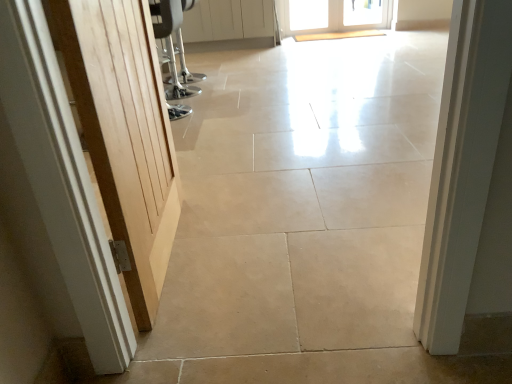
The height and width of the screenshot is (384, 512). What are the coordinates of `white glossy door at upper center, the 2th door from the top` in the screenshot? It's located at (228, 20).

From the image's perspective, is white glossy door at upper center, which is counted as the second door, starting from the back, on light wood door at left, which is the 3th door in back-to-front order?

Indeed, from the image's perspective, white glossy door at upper center, which is counted as the second door, starting from the back, is shown above light wood door at left, which is the 3th door in back-to-front order.

Considering the positions of point (245, 26) and point (124, 142), is point (245, 26) closer or farther from the camera than point (124, 142)?

Clearly, point (245, 26) is more distant from the camera than point (124, 142).

The width and height of the screenshot is (512, 384). In order to click on door below the white glossy door at upper center, the third door in the right-to-left sequence (from the image's perspective) in this screenshot , I will do `click(124, 132)`.

Between point (347, 21) and point (198, 24), which one is positioned behind?

Positioned behind is point (198, 24).

Is there a large distance between white glass door at upper center, which is the 1th door in right-to-left order, and white glossy door at upper center, the 2th door from the top?

They are positioned close to each other.

From the image's perspective, which one is positioned higher, white glass door at upper center, marked as the 1th door in a top-to-bottom arrangement, or white glossy door at upper center, which is the first door in left-to-right order?

white glass door at upper center, marked as the 1th door in a top-to-bottom arrangement, is shown above in the image.

Which is more to the right, white glass door at upper center, which appears as the first door when viewed from the back, or white glossy door at upper center, the 2th door from the top?

white glass door at upper center, which appears as the first door when viewed from the back, is more to the right.

From a real-world perspective, is light wood door at left, arranged as the first door when viewed from the front, located beneath white glass door at upper center, which appears as the first door when viewed from the back?

No, from a real-world perspective, light wood door at left, arranged as the first door when viewed from the front, is not below white glass door at upper center, which appears as the first door when viewed from the back.

Is white glass door at upper center, marked as the 1th door in a top-to-bottom arrangement, a part of light wood door at left, acting as the 2th door starting from the left?

No, white glass door at upper center, marked as the 1th door in a top-to-bottom arrangement, is not inside light wood door at left, acting as the 2th door starting from the left.

Is point (164, 120) closer or farther from the camera than point (341, 0)?

Point (164, 120) appears to be closer to the viewer than point (341, 0).

Does white glass door at upper center, which appears as the first door when viewed from the back, have a smaller size compared to light wood door at left, which is the 3th door in back-to-front order?

Correct, white glass door at upper center, which appears as the first door when viewed from the back, occupies less space than light wood door at left, which is the 3th door in back-to-front order.

From a real-world perspective, is white glass door at upper center, which is the 3th door from left to right, beneath light wood door at left, acting as the 2th door starting from the left?

Yes, from a real-world perspective, white glass door at upper center, which is the 3th door from left to right, is below light wood door at left, acting as the 2th door starting from the left.

Considering the sizes of objects white glass door at upper center, the third door viewed from the front, and light wood door at left, arranged as the first door when viewed from the front, in the image provided, who is thinner, white glass door at upper center, the third door viewed from the front, or light wood door at left, arranged as the first door when viewed from the front,?

Thinner between the two is white glass door at upper center, the third door viewed from the front.

Which is behind, point (169, 137) or point (234, 18)?

Point (234, 18)

Considering the positions of objects light wood door at left, arranged as the first door when viewed from the front, and white glossy door at upper center, placed as the 2th door when sorted from front to back, in the image provided, who is more to the right, light wood door at left, arranged as the first door when viewed from the front, or white glossy door at upper center, placed as the 2th door when sorted from front to back,?

From the viewer's perspective, light wood door at left, arranged as the first door when viewed from the front, appears more on the right side.

In the scene shown: Is there a large distance between light wood door at left, the second door from the right, and white glossy door at upper center, the third door in the right-to-left sequence?

Absolutely, light wood door at left, the second door from the right, is distant from white glossy door at upper center, the third door in the right-to-left sequence.

Could you tell me if light wood door at left, which is the 3th door in back-to-front order, is turned towards white glossy door at upper center, the 2th door from the top?

No, light wood door at left, which is the 3th door in back-to-front order, is not turned towards white glossy door at upper center, the 2th door from the top.

Looking at this image, from a real-world perspective, is white glossy door at upper center, the third door in the right-to-left sequence, physically located above or below white glass door at upper center, marked as the 1th door in a top-to-bottom arrangement?

Clearly, from a real-world perspective, white glossy door at upper center, the third door in the right-to-left sequence, is above white glass door at upper center, marked as the 1th door in a top-to-bottom arrangement.

Does white glossy door at upper center, which is the first door in left-to-right order, lie in front of white glass door at upper center, marked as the 1th door in a top-to-bottom arrangement?

Yes.

From the image's perspective, relative to white glass door at upper center, which is the 3th door from left to right, is white glossy door at upper center, the second door ordered from the bottom, above or below?

Based on their image positions, white glossy door at upper center, the second door ordered from the bottom, is located beneath white glass door at upper center, which is the 3th door from left to right.

Considering the relative sizes of white glossy door at upper center, the third door in the right-to-left sequence, and white glass door at upper center, which is the third door from bottom to top, in the image provided, is white glossy door at upper center, the third door in the right-to-left sequence, thinner than white glass door at upper center, which is the third door from bottom to top,?

In fact, white glossy door at upper center, the third door in the right-to-left sequence, might be wider than white glass door at upper center, which is the third door from bottom to top.

Which door is the 1st one when counting from the back of the light wood door at left, acting as the 2th door starting from the left? Please provide its 2D coordinates.

[(228, 20)]

From a real-world perspective, which door is the 1st one above the white glass door at upper center, which is the 1th door in right-to-left order? Please provide its 2D coordinates.

[(228, 20)]

From the image, which object appears to be farther from light wood door at left, acting as the 2th door starting from the left, white glass door at upper center, the third door viewed from the front, or white glossy door at upper center, placed as the 2th door when sorted from front to back?

white glass door at upper center, the third door viewed from the front.

Based on their spatial positions, is white glass door at upper center, which is the 1th door in right-to-left order, or light wood door at left, the second door from the right, closer to white glossy door at upper center, the third door in the right-to-left sequence?

white glass door at upper center, which is the 1th door in right-to-left order, lies closer to white glossy door at upper center, the third door in the right-to-left sequence, than the other object.

Based on their spatial positions, is white glossy door at upper center, the 2th door from the top, or light wood door at left, the second door from the right, further from white glass door at upper center, which appears as the first door when viewed from the back?

light wood door at left, the second door from the right, lies further to white glass door at upper center, which appears as the first door when viewed from the back, than the other object.

When comparing their distances from white glossy door at upper center, placed as the 2th door when sorted from front to back, does light wood door at left, which is the 3th door in back-to-front order, or white glass door at upper center, the third door viewed from the front, seem closer?

white glass door at upper center, the third door viewed from the front, lies closer to white glossy door at upper center, placed as the 2th door when sorted from front to back, than the other object.

Looking at the image, which one is located closer to white glass door at upper center, which is the 3th door from left to right, light wood door at left, which is the 3th door in back-to-front order, or white glossy door at upper center, placed as the 2th door when sorted from front to back?

white glossy door at upper center, placed as the 2th door when sorted from front to back, is closer to white glass door at upper center, which is the 3th door from left to right.

Which object lies further to the anchor point light wood door at left, arranged as the first door when viewed from the front, white glossy door at upper center, the third door in the right-to-left sequence, or white glass door at upper center, which appears as the first door when viewed from the back?

white glass door at upper center, which appears as the first door when viewed from the back, is further to light wood door at left, arranged as the first door when viewed from the front.

I want to click on door between light wood door at left, the second door from the right, and white glass door at upper center, which appears as the first door when viewed from the back, in the front-back direction, so click(228, 20).